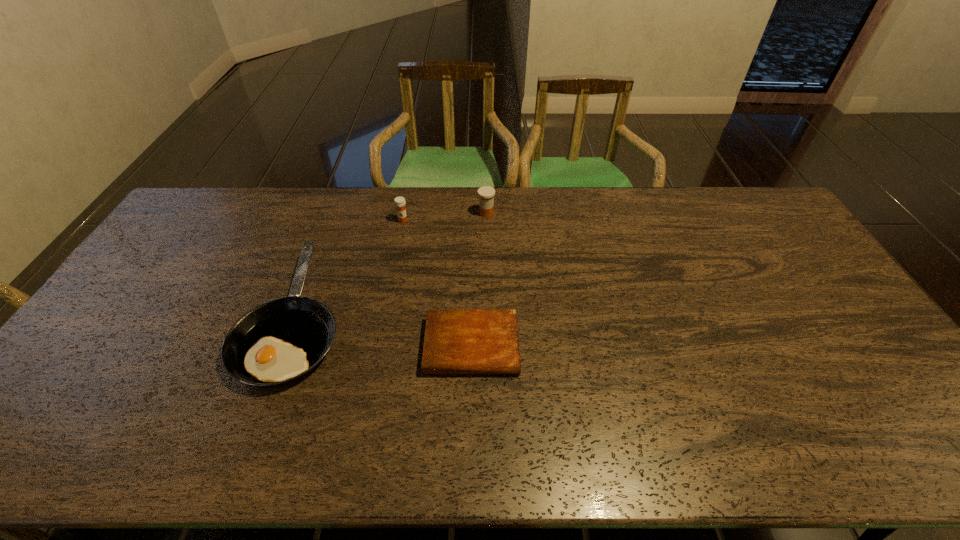
I want to click on vacant region that satisfies the following two spatial constraints: 1. on the label of the right medicine; 2. on the label side of the third object from right to left, so click(x=487, y=220).